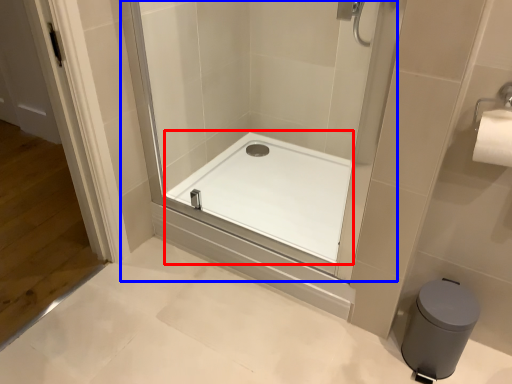
Question: Which point is closer to the camera, bath (highlighted by a red box) or shower door (highlighted by a blue box)?

Choices:
 (A) bath
 (B) shower door

Answer: (B)